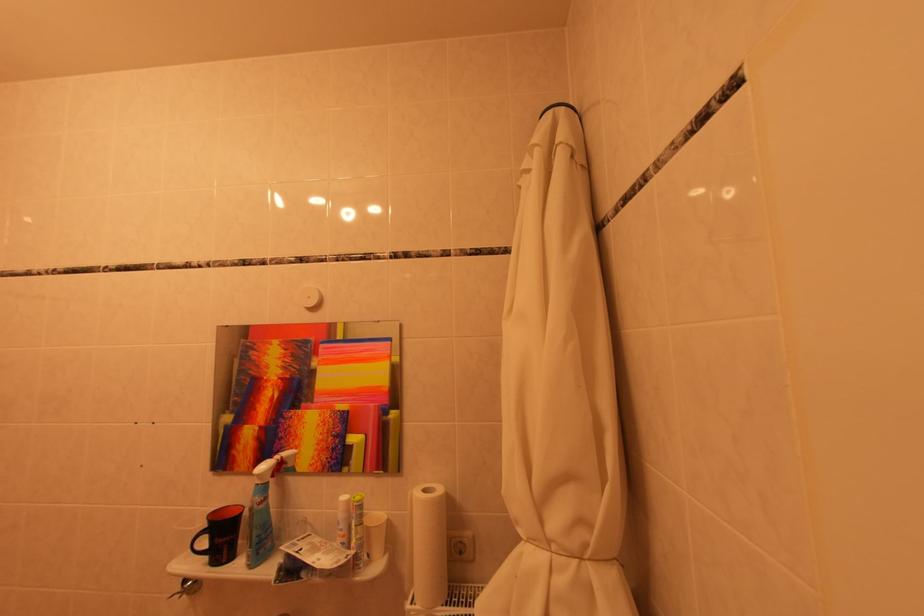
You are a GUI agent. You are given a task and a screenshot of the screen. Output one action in this format:
    pyautogui.click(x=<x>, y=<y>)
    Task: Click on the round white button
    The image size is (924, 616).
    Given the screenshot: What is the action you would take?
    pyautogui.click(x=310, y=297)